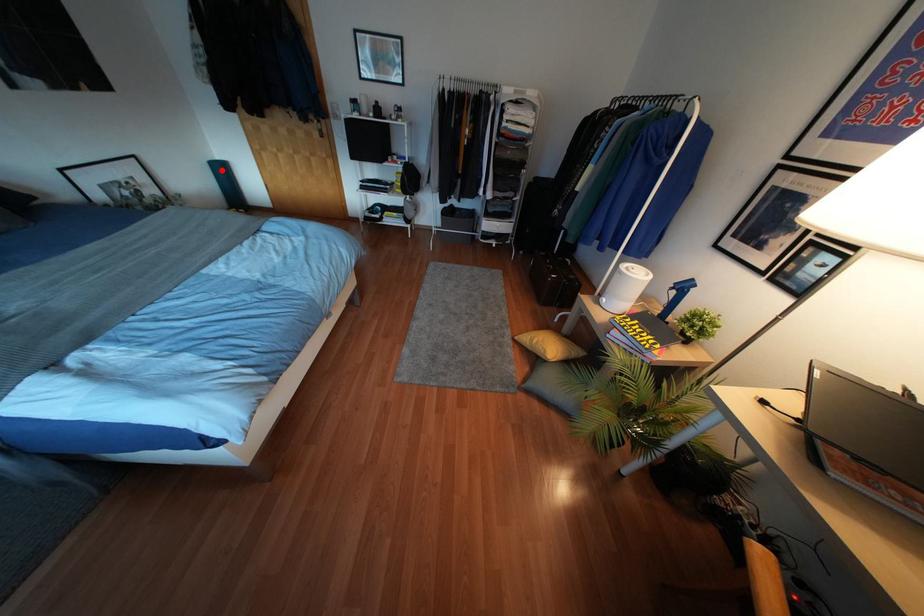
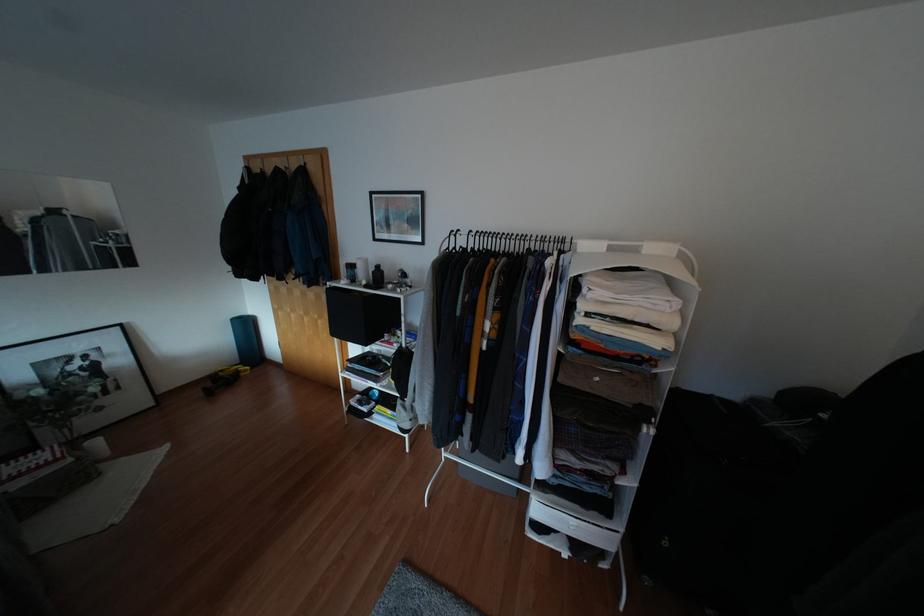
Find the pixel in the second image that matches the highlighted location in the first image.

(246, 325)